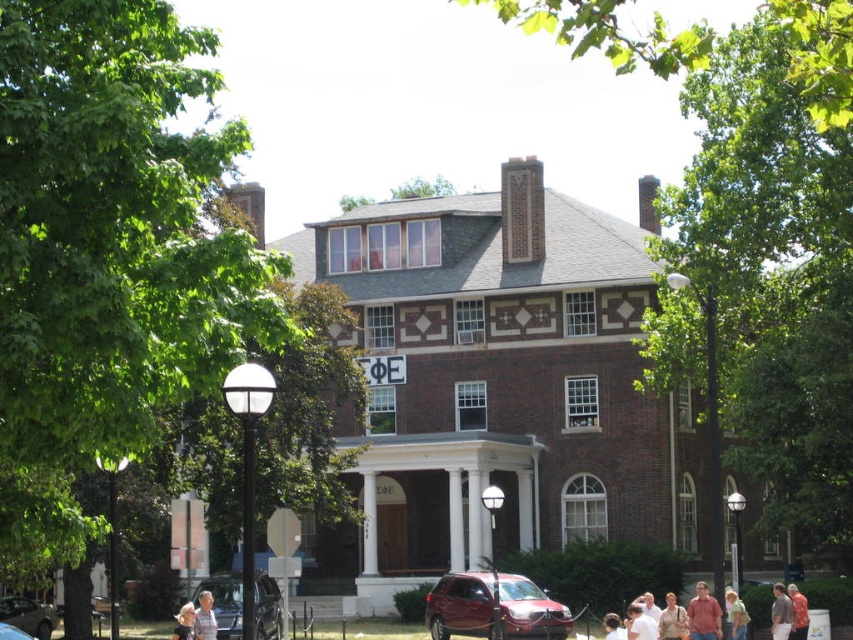
You are a photographer trying to capture both the light brown shirt at center and the light blue shirt at center in a single shot. Which person should you focus on first to ensure both are in frame?

You should focus on the light brown shirt at center first because it is larger and will be more prominent in the frame, ensuring both the light brown shirt at center and the light blue shirt at center are captured.

You are a pedestrian standing at the stop sign near the left side of the image. You want to cross the street to reach the two story brick building. Is the shiny red suv at lower center blocking your path to the blonde hair at lower left?

The shiny red suv at lower center is positioned over blonde hair at lower left, which means the suv is blocking the path to the blonde hair at lower left.